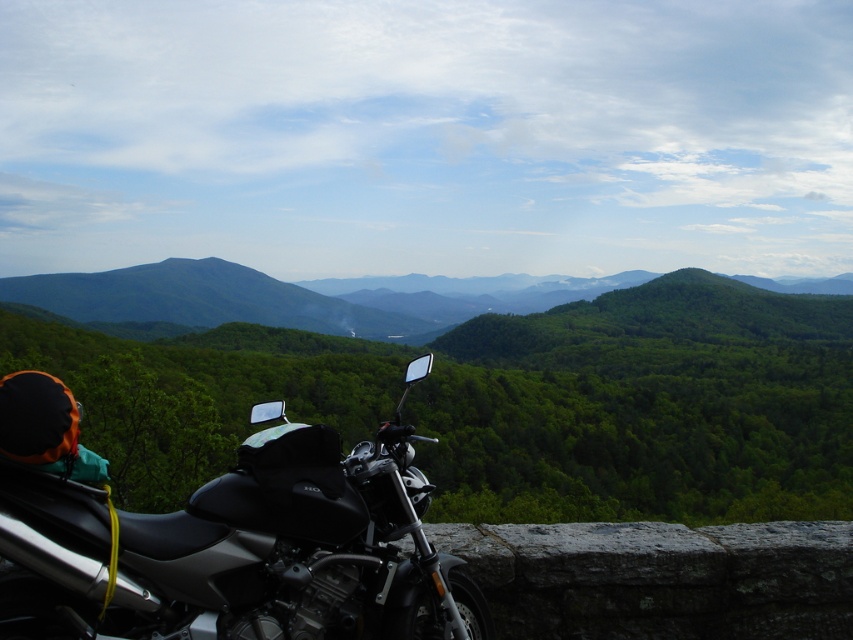
Does green forested mountain at center have a larger size compared to shiny black motorcycle at lower left?

Yes.

Who is more forward, (93,449) or (405,618)?

Positioned in front is point (405,618).

Who is more distant from viewer, (679, 449) or (368, 472)?

Point (679, 449)

At what (x,y) coordinates should I click in order to perform the action: click on green forested mountain at center. Please return your answer as a coordinate pair (x, y). Looking at the image, I should click on (645, 406).